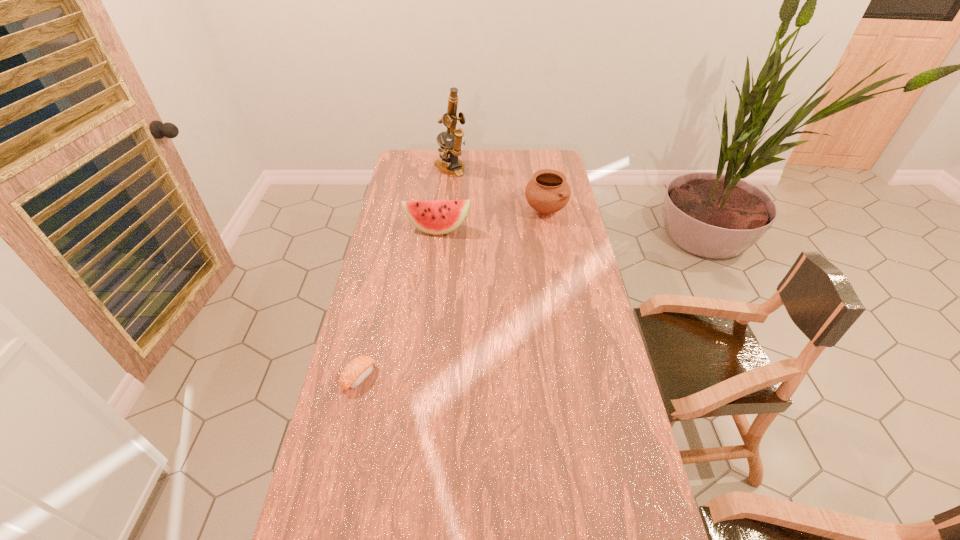
The width and height of the screenshot is (960, 540). I want to click on object that can be found as the closest to the tallest object, so click(x=548, y=192).

Where is `free point that satisfies the following two spatial constraints: 1. on the back side of the nearest object; 2. on the left side of the microscope`? This screenshot has width=960, height=540. free point that satisfies the following two spatial constraints: 1. on the back side of the nearest object; 2. on the left side of the microscope is located at coordinates (407, 168).